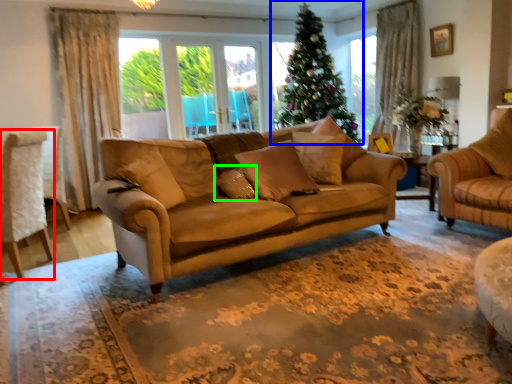
Question: Which is farther away from chair (highlighted by a red box)? christmas tree (highlighted by a blue box) or pillow (highlighted by a green box)?

Choices:
 (A) christmas tree
 (B) pillow

Answer: (A)